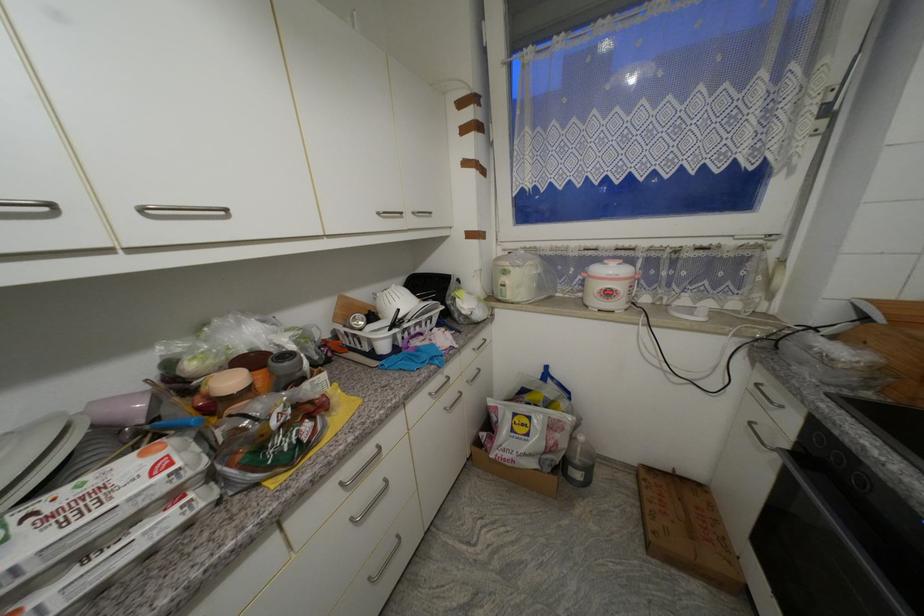
Where would you lift the white dish rack? Please return your answer as a coordinate pair (x, y).

(383, 321)